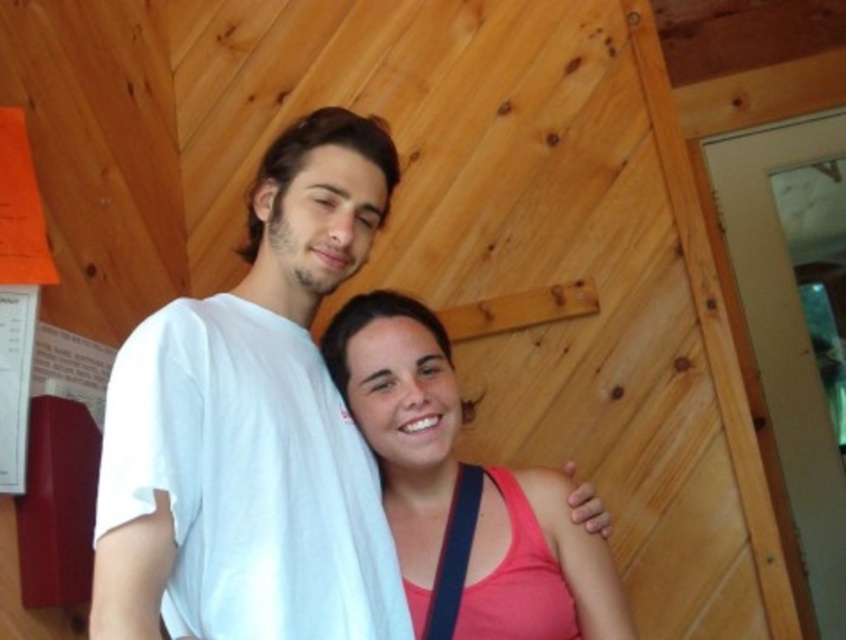
You are standing in a wooden cabin and see a point marked at coordinates [253,428]. What object in the scene is located at this point?

The point at [253,428] corresponds to the white cotton shirt at center.

You are standing in front of the wooden cabin and want to take a photo of both the white cotton shirt at center and the pink matte tank top at center. Which one should you focus on first to ensure both are in clear view?

You should focus on the white cotton shirt at center first since it is closer to the viewer than the pink matte tank top at center, ensuring both are in clear view when focused properly.

You are a photographer standing at the camera position. You want to focus on the white cotton shirt at center. Is it within the 1 meter focus range of your camera?

The white cotton shirt at center is 99.53 centimeters away from the camera, which is just under 1 meter. Therefore, it is within the focus range.